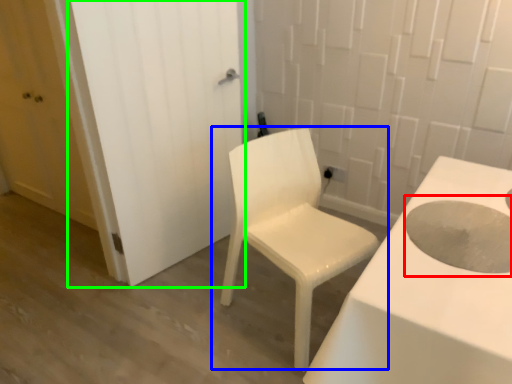
Question: Which object is the closest to the hole (highlighted by a red box)? Choose among these: chair (highlighted by a blue box) or door (highlighted by a green box).

Choices:
 (A) chair
 (B) door

Answer: (A)